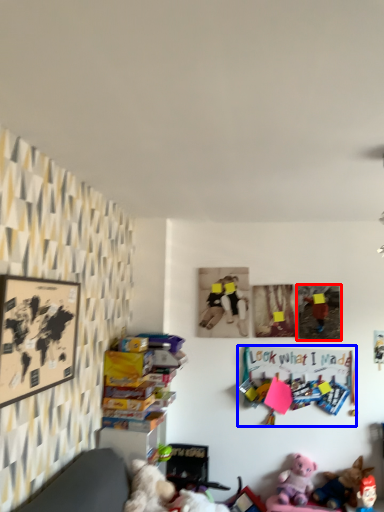
Question: Which of the following is the farthest to the observer, picture frame (highlighted by a red box) or bulletin board (highlighted by a blue box)?

Choices:
 (A) picture frame
 (B) bulletin board

Answer: (A)